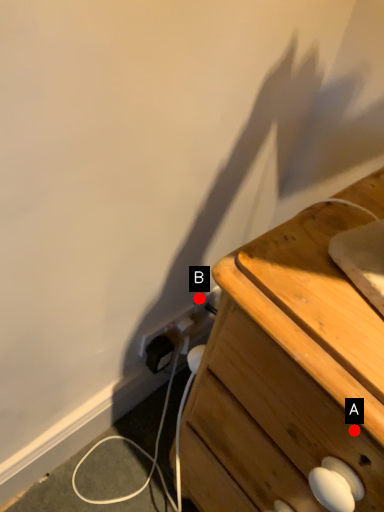
Question: Two points are circled on the image, labeled by A and B beside each circle. Which point appears closest to the camera in this image?

Choices:
 (A) A is closer
 (B) B is closer

Answer: (A)